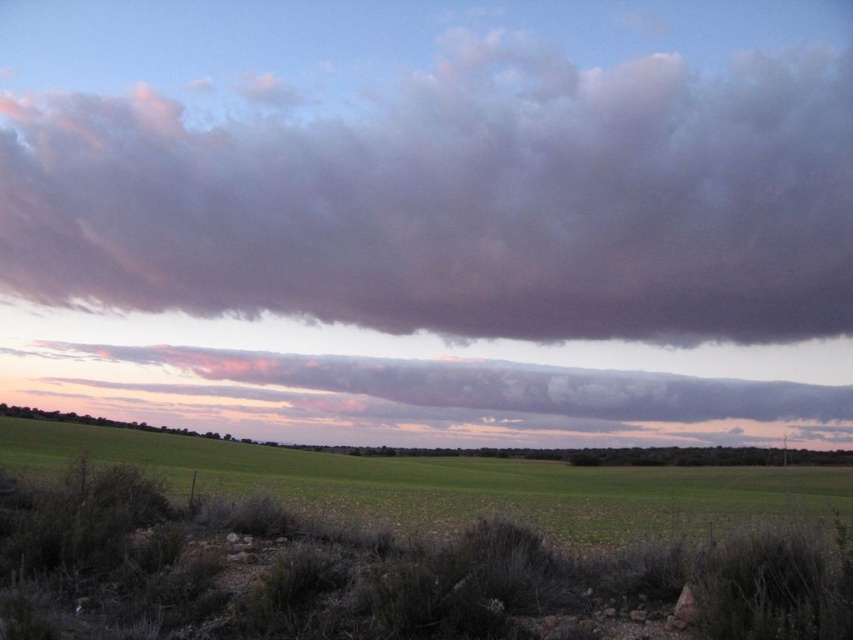
You are standing at the center of the field and want to walk to the green grass at lower center. Which direction should you go?

You should walk towards the lower center direction to reach the green grass at lower center.